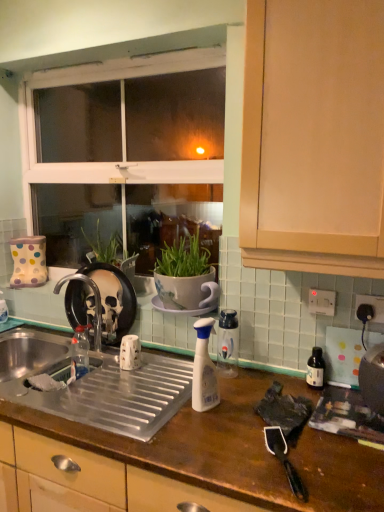
Question: Would you say brown wooden countertop at center contains white plastic spray bottle at center, which is the 4th bottle in back-to-front order?

Choices:
 (A) no
 (B) yes

Answer: (A)

Question: From a real-world perspective, does brown wooden countertop at center sit lower than white plastic spray bottle at center, acting as the third bottle starting from the right?

Choices:
 (A) no
 (B) yes

Answer: (B)

Question: From the image's perspective, is brown wooden countertop at center on top of white plastic spray bottle at center, acting as the third bottle starting from the right?

Choices:
 (A) yes
 (B) no

Answer: (B)

Question: From the image's perspective, does brown wooden countertop at center appear lower than white plastic spray bottle at center, which is counted as the 2th bottle, starting from the left?

Choices:
 (A) yes
 (B) no

Answer: (A)

Question: Considering the relative positions of brown wooden countertop at center and white plastic spray bottle at center, placed as the first bottle when sorted from front to back, in the image provided, is brown wooden countertop at center to the left of white plastic spray bottle at center, placed as the first bottle when sorted from front to back, from the viewer's perspective?

Choices:
 (A) no
 (B) yes

Answer: (B)

Question: In terms of width, does polka dot ceramic boot at left, the first appliance when ordered from left to right, look wider or thinner when compared to brown wooden countertop at center?

Choices:
 (A) thin
 (B) wide

Answer: (A)

Question: Considering the positions of point (38, 262) and point (304, 430), is point (38, 262) closer or farther from the camera than point (304, 430)?

Choices:
 (A) closer
 (B) farther

Answer: (B)

Question: Is polka dot ceramic boot at left, placed as the 1th appliance when sorted from back to front, inside the boundaries of brown wooden countertop at center, or outside?

Choices:
 (A) inside
 (B) outside

Answer: (B)

Question: From the image's perspective, is polka dot ceramic boot at left, placed as the 1th appliance when sorted from back to front, located above or below brown wooden countertop at center?

Choices:
 (A) above
 (B) below

Answer: (A)

Question: From a real-world perspective, is black glass bottle at right, which is the third bottle in back-to-front order, physically located above or below polka dot ceramic boot at left, placed as the 1th appliance when sorted from back to front?

Choices:
 (A) below
 (B) above

Answer: (A)

Question: Considering their positions, is black glass bottle at right, marked as the 2th bottle in a front-to-back arrangement, located in front of or behind polka dot ceramic boot at left, placed as the 2th appliance when sorted from bottom to top?

Choices:
 (A) front
 (B) behind

Answer: (A)

Question: Is black glass bottle at right, which appears as the 1th bottle when viewed from the right, taller or shorter than polka dot ceramic boot at left, acting as the 2th appliance starting from the front?

Choices:
 (A) short
 (B) tall

Answer: (A)

Question: From the image's perspective, is black glass bottle at right, marked as the 2th bottle in a front-to-back arrangement, located above or below polka dot ceramic boot at left, the first appliance when ordered from left to right?

Choices:
 (A) above
 (B) below

Answer: (B)

Question: From a real-world perspective, is white plastic electric outlet at upper right, arranged as the 2th electric outlet when viewed from the right, physically located above or below metallic stainless steel kettle at right, which appears as the first appliance when ordered from the bottom?

Choices:
 (A) above
 (B) below

Answer: (A)

Question: From their relative heights in the image, would you say white plastic electric outlet at upper right, the second electric outlet positioned from the front, is taller or shorter than metallic stainless steel kettle at right, which appears as the first appliance when ordered from the bottom?

Choices:
 (A) short
 (B) tall

Answer: (A)